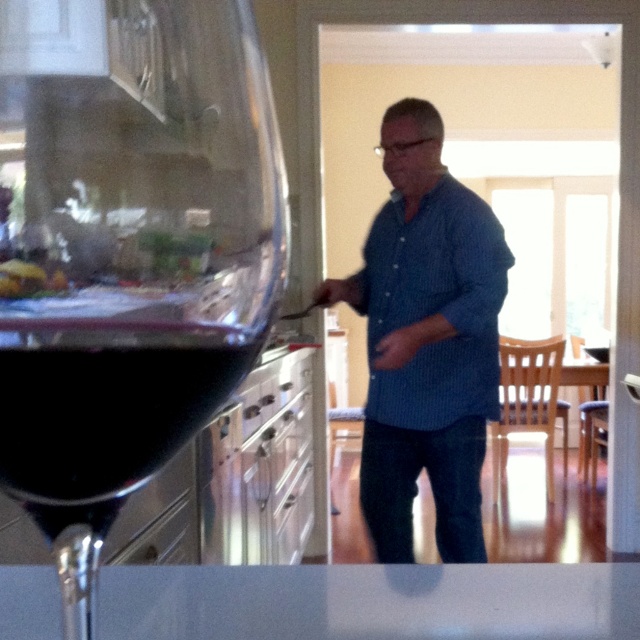
Does dark glass at left have a greater width compared to dark red liquid at left?

Indeed, dark glass at left has a greater width compared to dark red liquid at left.

Can you confirm if dark glass at left is thinner than dark red liquid at left?

No.

Between point (113, 266) and point (54, 454), which one is positioned in front?

Positioned in front is point (113, 266).

The height and width of the screenshot is (640, 640). I want to click on dark glass at left, so click(128, 250).

Is the position of blue striped shirt at center less distant than that of dark red liquid at left?

No, it is not.

Can you confirm if blue striped shirt at center is positioned below dark red liquid at left?

Correct, blue striped shirt at center is located below dark red liquid at left.

Who is more distant from viewer, (388, 556) or (120, 364)?

Point (388, 556)

Where is `blue striped shirt at center`? The width and height of the screenshot is (640, 640). blue striped shirt at center is located at coordinates (426, 340).

Can you confirm if dark glass at left is bigger than blue striped shirt at center?

Actually, dark glass at left might be smaller than blue striped shirt at center.

Which is above, dark glass at left or blue striped shirt at center?

dark glass at left

What do you see at coordinates (128, 250) in the screenshot? The width and height of the screenshot is (640, 640). I see `dark glass at left` at bounding box center [128, 250].

Where is `dark glass at left`? This screenshot has height=640, width=640. dark glass at left is located at coordinates (128, 250).